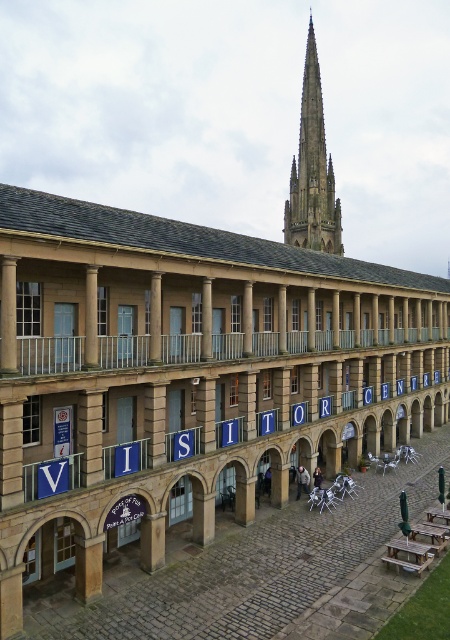
Question: Can you confirm if dark gray stone spire at upper center is positioned to the left of wooden picnic table at lower right?

Choices:
 (A) no
 (B) yes

Answer: (A)

Question: Which of the following is the farthest from the observer?

Choices:
 (A) wooden picnic table at lower right
 (B) silver metallic railing at center
 (C) dark gray stone spire at upper center

Answer: (C)

Question: Where is dark gray stone spire at upper center located in relation to wooden picnic table at lower right in the image?

Choices:
 (A) below
 (B) above

Answer: (B)

Question: Which point appears farthest from the camera in this image?

Choices:
 (A) (54, 337)
 (B) (412, 563)
 (C) (319, 83)

Answer: (C)

Question: Is dark gray stone spire at upper center thinner than wooden picnic table at lower right?

Choices:
 (A) no
 (B) yes

Answer: (A)

Question: Which point is closer to the camera?

Choices:
 (A) (424, 540)
 (B) (234, 349)
 (C) (295, 212)

Answer: (A)